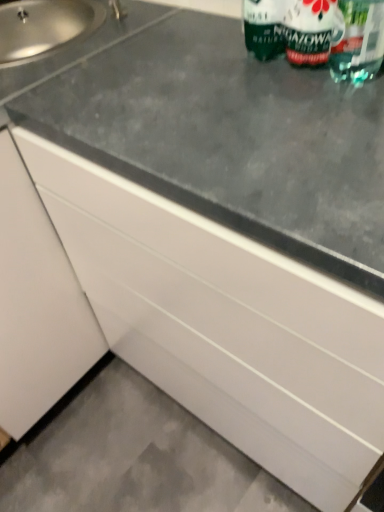
Find the location of a particular element. free space in front of transparent plastic straw at upper right is located at coordinates (349, 128).